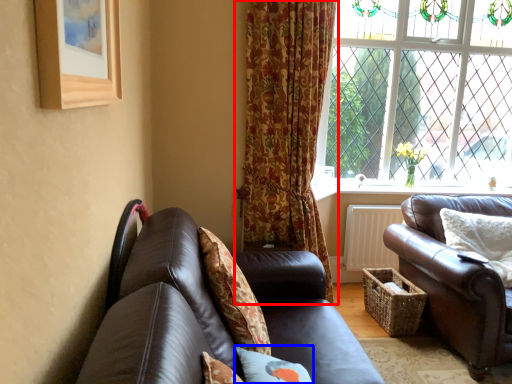
Question: Which point is closer to the camera, curtain (highlighted by a red box) or pillow (highlighted by a blue box)?

Choices:
 (A) curtain
 (B) pillow

Answer: (B)